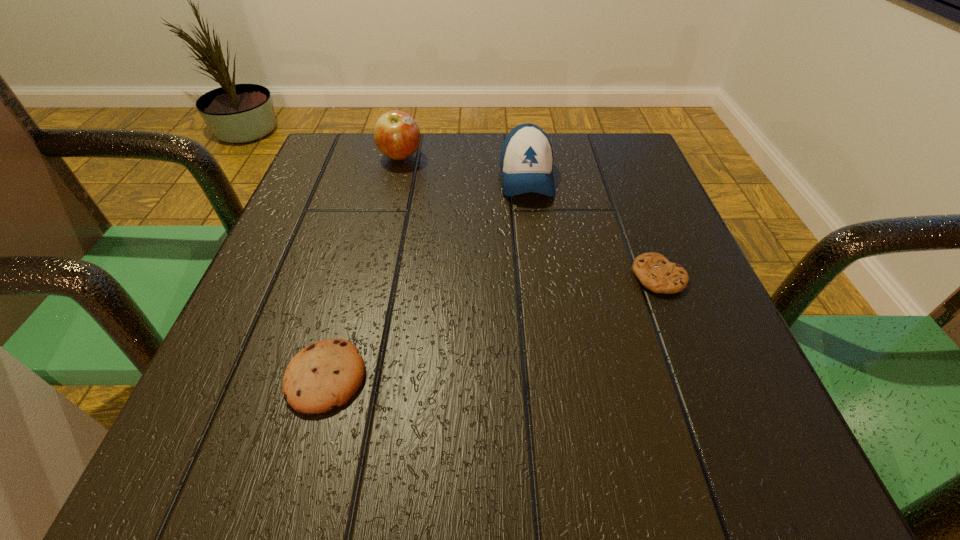
Identify the location of vacant area that lies between the second object from right to left and the apple. Image resolution: width=960 pixels, height=540 pixels. (464, 167).

The width and height of the screenshot is (960, 540). In order to click on free space between the apple and the second object from right to left in this screenshot , I will do `click(464, 167)`.

Identify which object is the second closest to the rightmost object. Please provide its 2D coordinates. Your answer should be formatted as a tuple, i.e. [(x, y)], where the tuple contains the x and y coordinates of a point satisfying the conditions above.

[(327, 373)]

Identify which object is the third nearest to the right cookie. Please provide its 2D coordinates. Your answer should be formatted as a tuple, i.e. [(x, y)], where the tuple contains the x and y coordinates of a point satisfying the conditions above.

[(397, 135)]

Where is `free point that satisfies the following two spatial constraints: 1. on the front-facing side of the right cookie; 2. on the left side of the third object from left to right`? free point that satisfies the following two spatial constraints: 1. on the front-facing side of the right cookie; 2. on the left side of the third object from left to right is located at coordinates (540, 277).

The height and width of the screenshot is (540, 960). I want to click on vacant space that satisfies the following two spatial constraints: 1. on the front-facing side of the third object from left to right; 2. on the left side of the farther cookie, so click(540, 277).

The image size is (960, 540). What are the coordinates of `free spot that satisfies the following two spatial constraints: 1. on the back side of the taller cookie; 2. on the left side of the shorter cookie` in the screenshot? It's located at (353, 277).